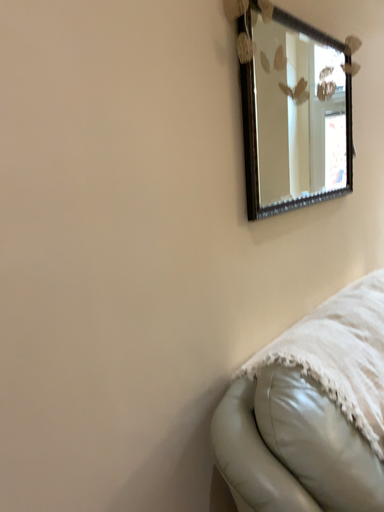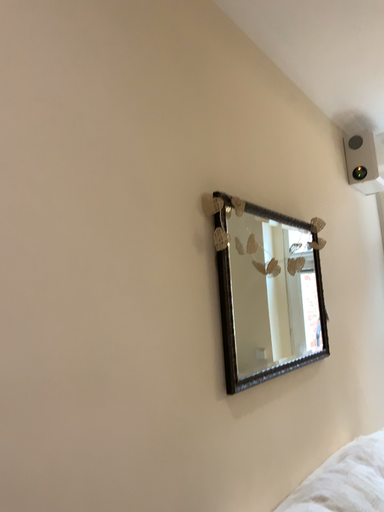
Question: How did the camera likely rotate when shooting the video?

Choices:
 (A) rotated upward
 (B) rotated downward

Answer: (A)